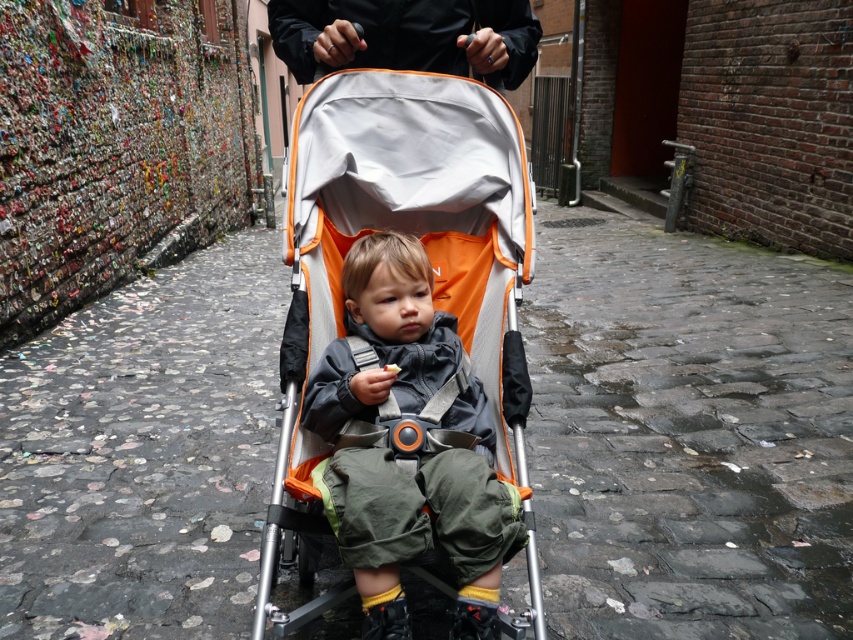
Between orange fabric baby carriage at center and black matte jacket at upper center, which one is positioned lower?

Positioned lower is orange fabric baby carriage at center.

Can you confirm if orange fabric baby carriage at center is positioned to the left of black matte jacket at upper center?

Incorrect, orange fabric baby carriage at center is not on the left side of black matte jacket at upper center.

Does point (517, 257) come behind point (486, 20)?

That is False.

You are a GUI agent. You are given a task and a screenshot of the screen. Output one action in this format:
    pyautogui.click(x=<x>, y=<y>)
    Task: Click on the orange fabric baby carriage at center
    The image size is (853, 640).
    Given the screenshot: What is the action you would take?
    pos(415,237)